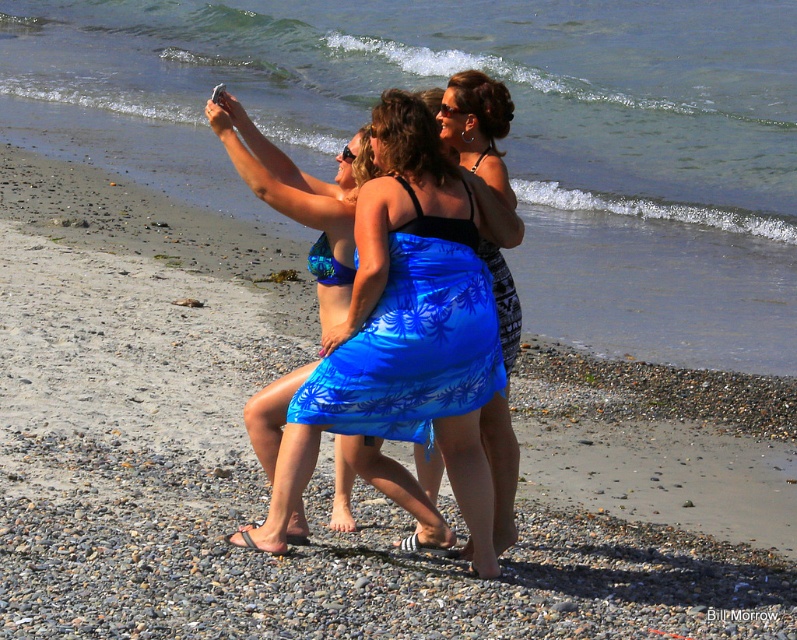
Question: Which object appears farthest from the camera in this image?

Choices:
 (A) blue fabric sarong at center
 (B) blue fabric skirt at center
 (C) shiny blue sarong at center

Answer: (A)

Question: Observing the image, what is the correct spatial positioning of shiny blue sarong at center in reference to blue fabric skirt at center?

Choices:
 (A) right
 (B) left

Answer: (B)

Question: Which of the following is the closest to the observer?

Choices:
 (A) (501, 458)
 (B) (379, 417)
 (C) (277, 403)

Answer: (B)

Question: Which point is farther to the camera?

Choices:
 (A) blue fabric skirt at center
 (B) shiny blue sarong at center

Answer: (A)

Question: Does blue fabric sarong at center appear over blue fabric skirt at center?

Choices:
 (A) yes
 (B) no

Answer: (A)

Question: Is shiny blue sarong at center to the left of blue fabric skirt at center from the viewer's perspective?

Choices:
 (A) yes
 (B) no

Answer: (A)